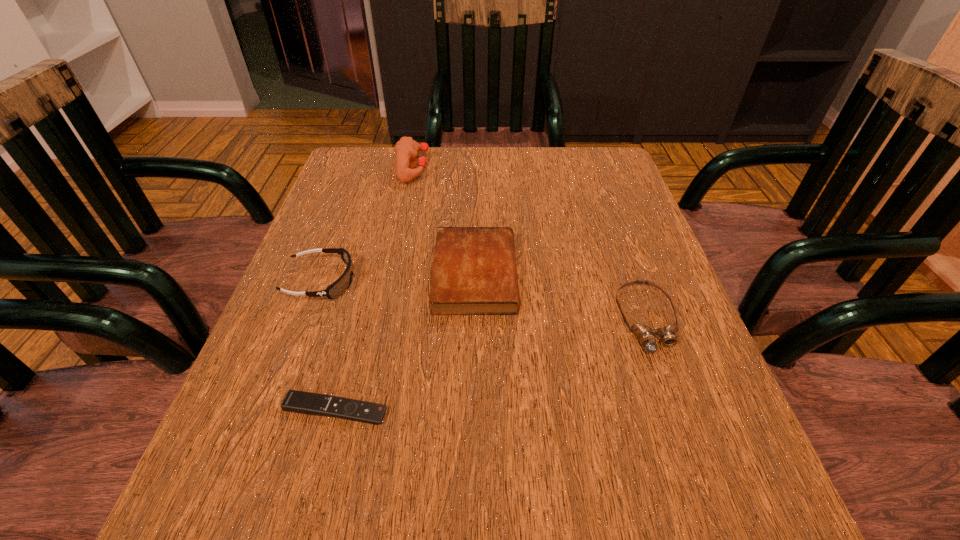
The width and height of the screenshot is (960, 540). Find the location of `vacant position located 0.240m with the gloves of the farthest object facing forward`. vacant position located 0.240m with the gloves of the farthest object facing forward is located at coordinates (521, 168).

The height and width of the screenshot is (540, 960). What are the coordinates of `vacant space located 0.350m on the front and sides of the fourth shortest object` in the screenshot? It's located at (538, 281).

This screenshot has height=540, width=960. I want to click on vacant space located on the spine side of the third tallest object, so click(x=567, y=274).

This screenshot has width=960, height=540. In order to click on vacant space situated 0.150m on the front lenses and sides of the right goggles in this screenshot , I will do `click(693, 448)`.

The height and width of the screenshot is (540, 960). What are the coordinates of `blank space located on the back of the shortest object` in the screenshot? It's located at pos(353,342).

Where is `object that is at the far edge`? The image size is (960, 540). object that is at the far edge is located at coordinates (406, 149).

The height and width of the screenshot is (540, 960). What are the coordinates of `puncher at the left edge` in the screenshot? It's located at (406, 149).

Locate an element on the screen. The height and width of the screenshot is (540, 960). goggles at the left edge is located at coordinates (342, 284).

The image size is (960, 540). Identify the location of remote control that is at the left edge. [x=295, y=401].

Where is `object that is positioned at the right edge`? object that is positioned at the right edge is located at coordinates (646, 334).